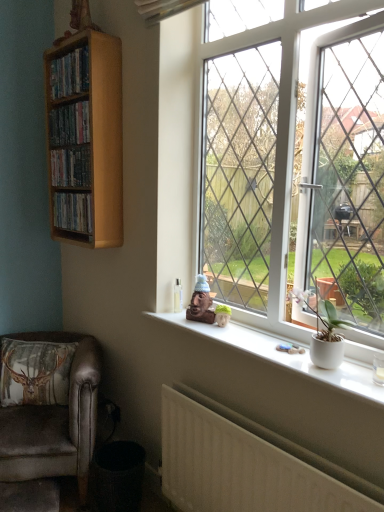
Question: Looking at the image, does velvety brown pillow at lower left seem bigger or smaller compared to wooden shelf at left, which ranks as the second book in bottom-to-top order?

Choices:
 (A) small
 (B) big

Answer: (B)

Question: From the image's perspective, is velvety brown pillow at lower left above or below wooden shelf at left, the 2th book viewed from the top?

Choices:
 (A) above
 (B) below

Answer: (B)

Question: Which is nearer to the wooden shelf at upper left, which ranks as the first book in bottom-to-top order?

Choices:
 (A) wooden shelf at upper left, positioned as the 1th book in top-to-bottom order
 (B) wooden bookshelf at upper left
 (C) white plastic window at center
 (D) white matte pot at window
 (E) velvet brown armchair at lower left

Answer: (B)

Question: Estimate the real-world distances between objects in this image. Which object is farther from the wooden shelf at left, which ranks as the second book in bottom-to-top order?

Choices:
 (A) wooden shelf at upper left, positioned as the 1th book in top-to-bottom order
 (B) wooden bookshelf at upper left
 (C) velvety brown pillow at lower left
 (D) wooden shelf at upper left, the 3th book positioned from the top
 (E) white textured radiator at lower center

Answer: (E)